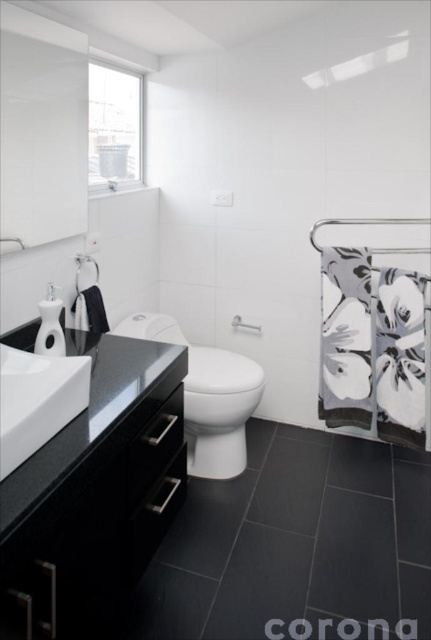
Question: Does white glossy toilet bowl at center lie behind white glossy shower at upper center?

Choices:
 (A) yes
 (B) no

Answer: (B)

Question: Is white glossy sink at center wider than white glossy shower at upper center?

Choices:
 (A) yes
 (B) no

Answer: (A)

Question: Estimate the real-world distances between objects in this image. Which object is farther from the satin nickel shower at center?

Choices:
 (A) black glossy vanity at left
 (B) white glossy shower at upper center

Answer: (A)

Question: Based on their relative distances, which object is nearer to the white glossy shower at upper center?

Choices:
 (A) satin nickel shower at center
 (B) brushed metal faucet at upper left
 (C) white glossy toilet bowl at center

Answer: (B)

Question: Is white glossy sink at center bigger than white glossy faucet at upper left?

Choices:
 (A) no
 (B) yes

Answer: (B)

Question: Which of the following is the farthest from the observer?

Choices:
 (A) white glossy toilet bowl at center
 (B) white glossy faucet at upper left
 (C) brushed metal faucet at upper left
 (D) white glossy shower at upper center

Answer: (D)